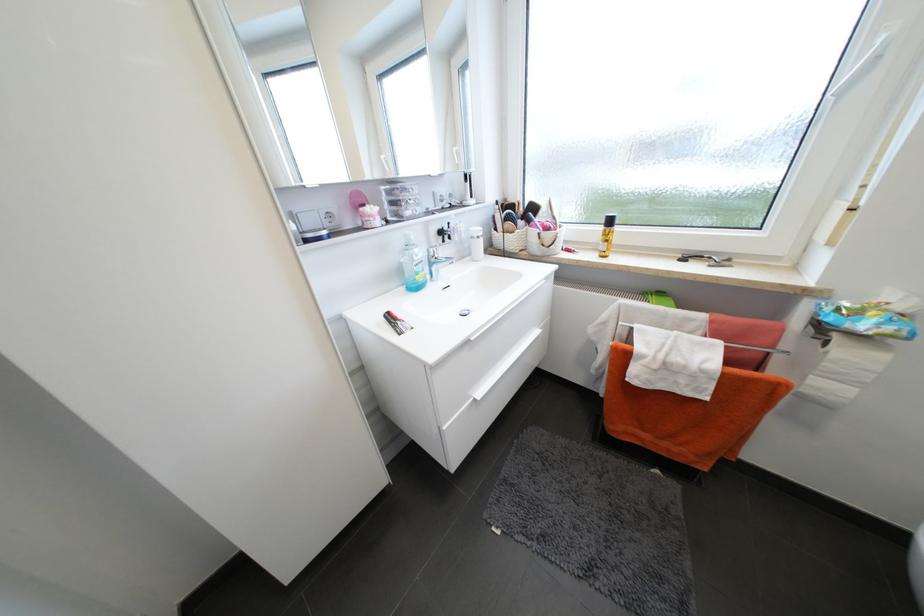
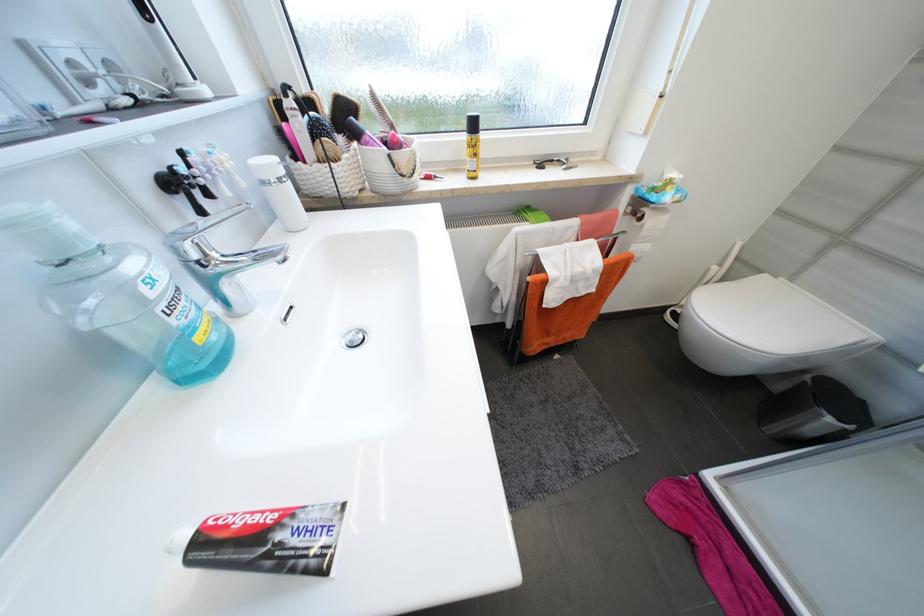
Where in the second image is the point corresponding to (x=405, y=323) from the first image?

(285, 537)